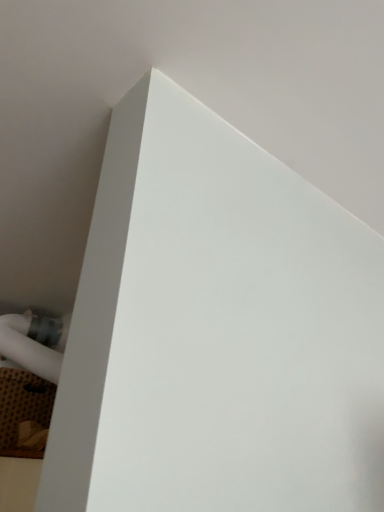
In order to face brown textured rug at lower left, should I rotate leftwards or rightwards?

Turn left by 22.370 degrees to look at brown textured rug at lower left.

Describe the element at coordinates (24, 413) in the screenshot. This screenshot has height=512, width=384. I see `brown textured rug at lower left` at that location.

You are a GUI agent. You are given a task and a screenshot of the screen. Output one action in this format:
    pyautogui.click(x=<x>, y=<y>)
    Task: Click on the brown textured rug at lower left
    
    Given the screenshot: What is the action you would take?
    pyautogui.click(x=24, y=413)

In order to click on brown textured rug at lower left in this screenshot , I will do `click(24, 413)`.